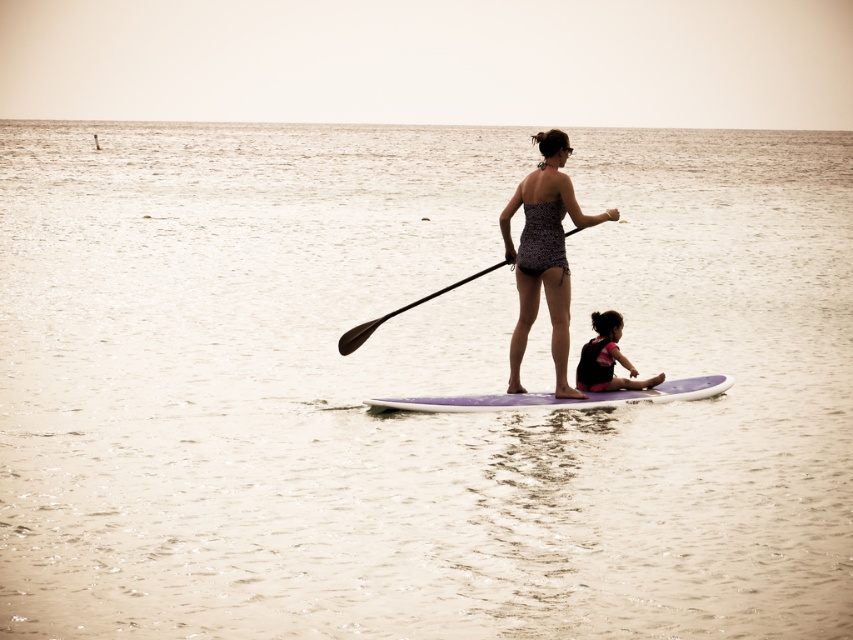
From the picture: Is printed fabric swimsuit at center bigger than matte pink swimsuit at center?

Indeed, printed fabric swimsuit at center has a larger size compared to matte pink swimsuit at center.

From the picture: Who is more forward, (x=566, y=387) or (x=618, y=323)?

Positioned in front is point (x=566, y=387).

Find the location of a particular element. printed fabric swimsuit at center is located at coordinates click(544, 253).

Can you confirm if printed fabric swimsuit at center is thinner than black rubber paddle at center?

Yes, printed fabric swimsuit at center is thinner than black rubber paddle at center.

Which is in front, point (524, 390) or point (399, 307)?

Point (524, 390) is in front.

Who is more forward, (560, 212) or (354, 332)?

Point (560, 212) is in front.

You are a GUI agent. You are given a task and a screenshot of the screen. Output one action in this format:
    pyautogui.click(x=<x>, y=<y>)
    Task: Click on the printed fabric swimsuit at center
    
    Given the screenshot: What is the action you would take?
    pyautogui.click(x=544, y=253)

Which of these two, printed fabric swimsuit at center or purple smooth surfboard at center, stands shorter?

purple smooth surfboard at center is shorter.

Does printed fabric swimsuit at center have a greater height compared to purple smooth surfboard at center?

Indeed, printed fabric swimsuit at center has a greater height compared to purple smooth surfboard at center.

Does point (526, 339) come closer to viewer compared to point (503, 394)?

No.

Where is `printed fabric swimsuit at center`? Image resolution: width=853 pixels, height=640 pixels. printed fabric swimsuit at center is located at coordinates pos(544,253).